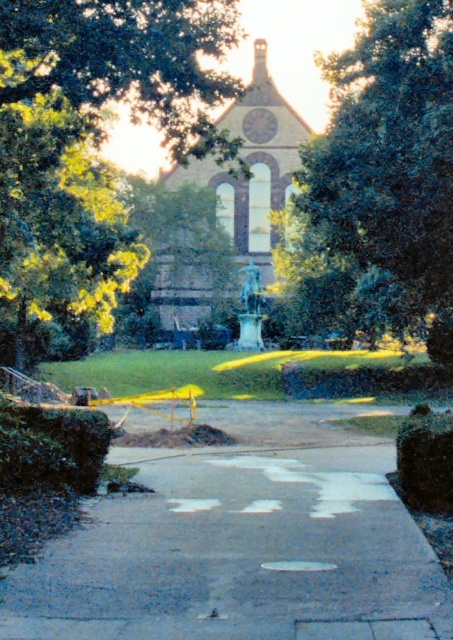
Is green leafy tree at upper center in front of brown stone church at center?

Yes, green leafy tree at upper center is in front of brown stone church at center.

Locate an element on the screen. The width and height of the screenshot is (453, 640). green leafy tree at upper center is located at coordinates (92, 141).

Does gray concrete sidewalk at center appear on the right side of brown stone church at center?

Yes, gray concrete sidewalk at center is to the right of brown stone church at center.

Does gray concrete sidewalk at center have a greater width compared to brown stone church at center?

In fact, gray concrete sidewalk at center might be narrower than brown stone church at center.

Which is in front, point (85, 536) or point (216, 122)?

Point (85, 536) is more forward.

Find the location of `gray concrete sidewalk at center`. gray concrete sidewalk at center is located at coordinates (240, 556).

Does green leafy tree at center appear over brown stone church at center?

Incorrect, green leafy tree at center is not positioned above brown stone church at center.

Where is `green leafy tree at center`? The image size is (453, 640). green leafy tree at center is located at coordinates (389, 161).